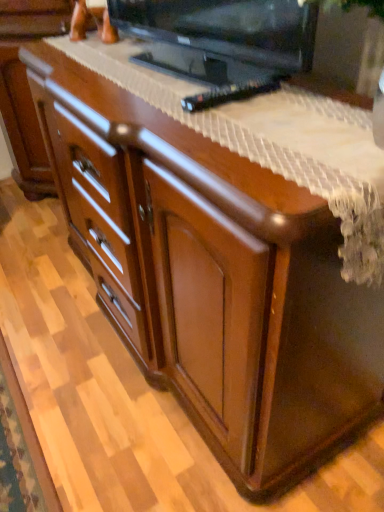
Identify the location of black plastic remote at center. This screenshot has width=384, height=512. (229, 94).

The height and width of the screenshot is (512, 384). Describe the element at coordinates (229, 94) in the screenshot. I see `black plastic remote at center` at that location.

Image resolution: width=384 pixels, height=512 pixels. Describe the element at coordinates (227, 28) in the screenshot. I see `black glossy television at upper center` at that location.

Where is `black glossy television at upper center`? black glossy television at upper center is located at coordinates (227, 28).

Find the location of a particular element. black plastic remote at center is located at coordinates (229, 94).

Which is more to the left, black plastic remote at center or black glossy television at upper center?

black glossy television at upper center.

Which object is closer to the camera, black plastic remote at center or black glossy television at upper center?

black glossy television at upper center is more forward.

Between point (249, 87) and point (157, 29), which one is positioned behind?

The point (157, 29) is more distant.

From the image's perspective, is black plastic remote at center below black glossy television at upper center?

Correct, black plastic remote at center appears lower than black glossy television at upper center in the image.

From a real-world perspective, is black plastic remote at center under black glossy television at upper center?

Indeed, from a real-world perspective, black plastic remote at center is positioned beneath black glossy television at upper center.

Can you confirm if black plastic remote at center is thinner than black glossy television at upper center?

Correct, the width of black plastic remote at center is less than that of black glossy television at upper center.

Is black plastic remote at center shorter than black glossy television at upper center?

Yes.

Who is smaller, black plastic remote at center or black glossy television at upper center?

Smaller between the two is black plastic remote at center.

Is black plastic remote at center situated inside black glossy television at upper center or outside?

black plastic remote at center can be found inside black glossy television at upper center.

Is black plastic remote at center not near black glossy television at upper center?

No.

Does black plastic remote at center turn towards black glossy television at upper center?

No, black plastic remote at center is not aimed at black glossy television at upper center.

Measure the distance between black plastic remote at center and black glossy television at upper center.

black plastic remote at center and black glossy television at upper center are 8.07 inches apart.

Image resolution: width=384 pixels, height=512 pixels. I want to click on remote that appears below the black glossy television at upper center (from a real-world perspective), so click(x=229, y=94).

Between black glossy television at upper center and black plastic remote at center, which one appears on the left side from the viewer's perspective?

From the viewer's perspective, black glossy television at upper center appears more on the left side.

Considering the positions of objects black glossy television at upper center and black plastic remote at center in the image provided, who is behind, black glossy television at upper center or black plastic remote at center?

Positioned behind is black plastic remote at center.

Which is less distant, (x=209, y=10) or (x=193, y=96)?

Positioned in front is point (x=193, y=96).

From the image's perspective, which is below, black glossy television at upper center or black plastic remote at center?

black plastic remote at center is shown below in the image.

From a real-world perspective, which object rests below the other?

black plastic remote at center.

Looking at their sizes, would you say black glossy television at upper center is wider or thinner than black plastic remote at center?

In the image, black glossy television at upper center appears to be wider than black plastic remote at center.

Who is taller, black glossy television at upper center or black plastic remote at center?

With more height is black glossy television at upper center.

In terms of size, does black glossy television at upper center appear bigger or smaller than black plastic remote at center?

Considering their sizes, black glossy television at upper center takes up more space than black plastic remote at center.

Do you think black glossy television at upper center is within black plastic remote at center, or outside of it?

black glossy television at upper center cannot be found inside black plastic remote at center.

Is black glossy television at upper center far from black plastic remote at center?

They are positioned close to each other.

Could you tell me if black glossy television at upper center is facing black plastic remote at center?

Yes, black glossy television at upper center is turned towards black plastic remote at center.

How much distance is there between black glossy television at upper center and black plastic remote at center?

The distance of black glossy television at upper center from black plastic remote at center is 8.07 inches.

Locate an element on the screen. The height and width of the screenshot is (512, 384). remote below the black glossy television at upper center (from the image's perspective) is located at coordinates (229, 94).

At what (x,y) coordinates should I click in order to perform the action: click on remote lying below the black glossy television at upper center (from the image's perspective). Please return your answer as a coordinate pair (x, y). Image resolution: width=384 pixels, height=512 pixels. Looking at the image, I should click on [229, 94].

I want to click on television in front of the black plastic remote at center, so click(227, 28).